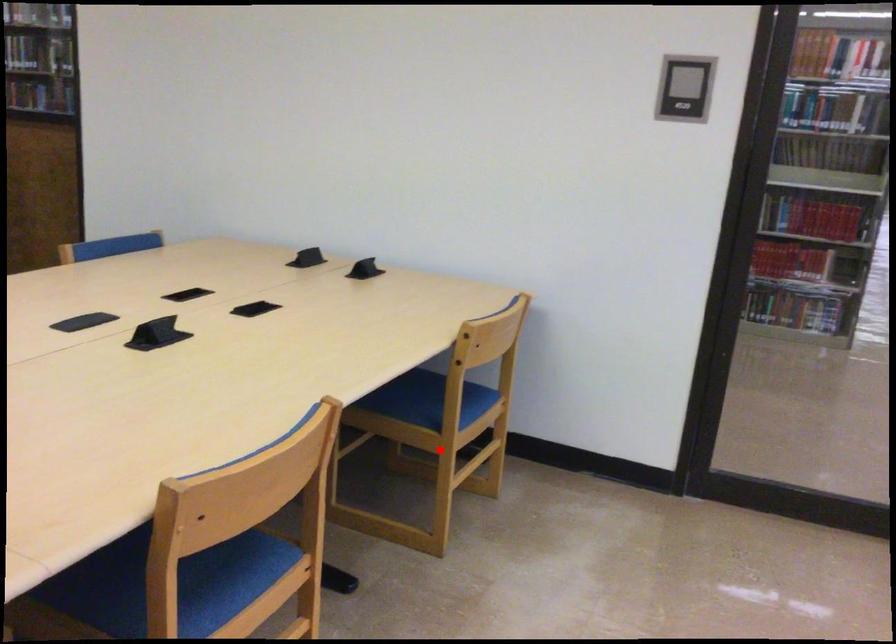
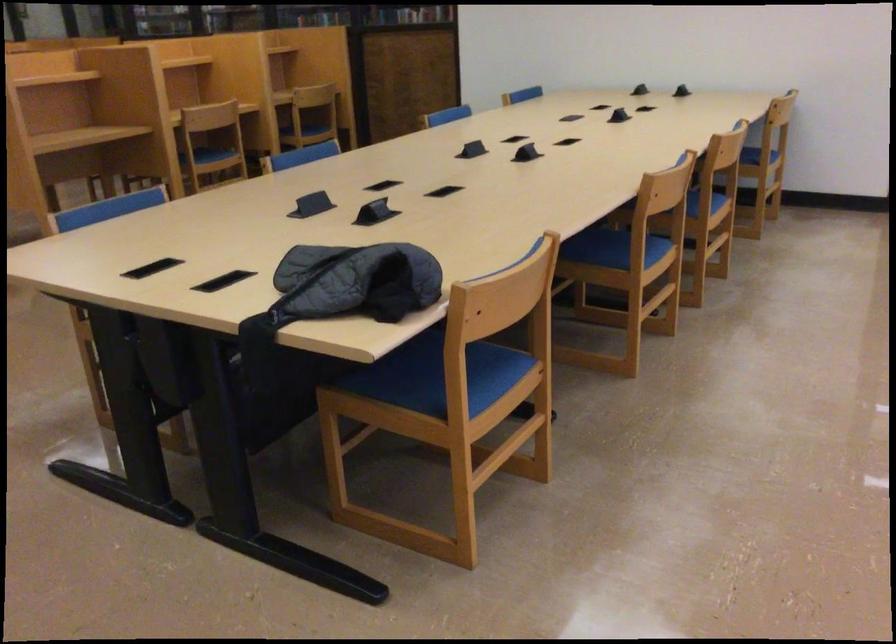
Question: I am providing you with two images of the same scene from different viewpoints. A red point is marked on the first image. Is the red point's position out of view in image 2?

Choices:
 (A) Yes
 (B) No

Answer: (B)